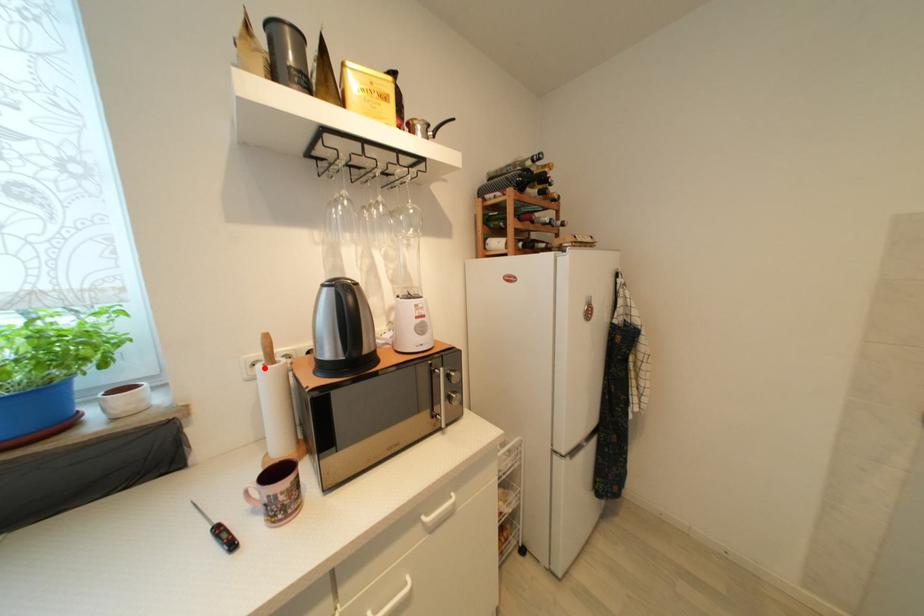
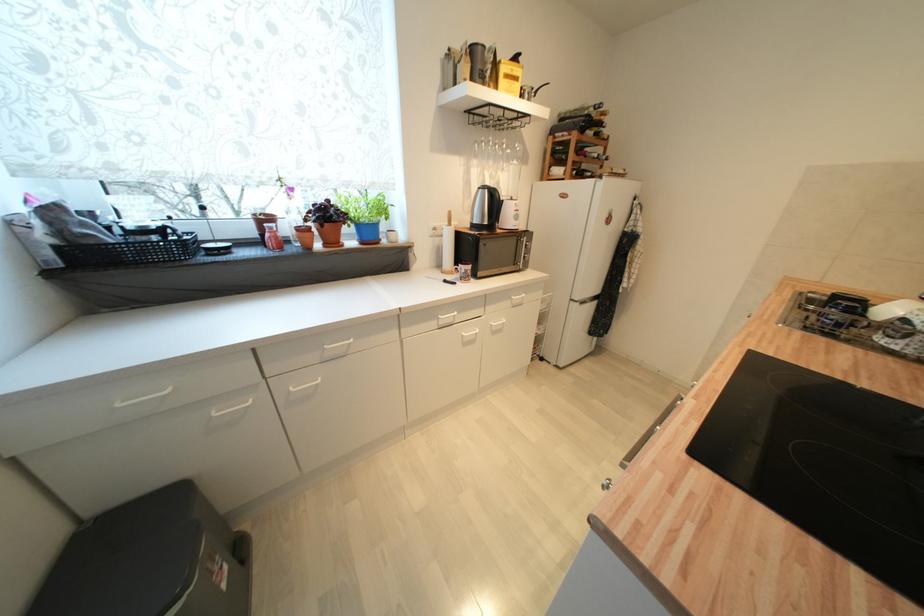
Question: I am providing you with two images of the same scene from different viewpoints. In image1, a red point is highlighted. Considering the same 3D point in image2, which of the following is correct?

Choices:
 (A) It is closer
 (B) It is farther

Answer: (A)